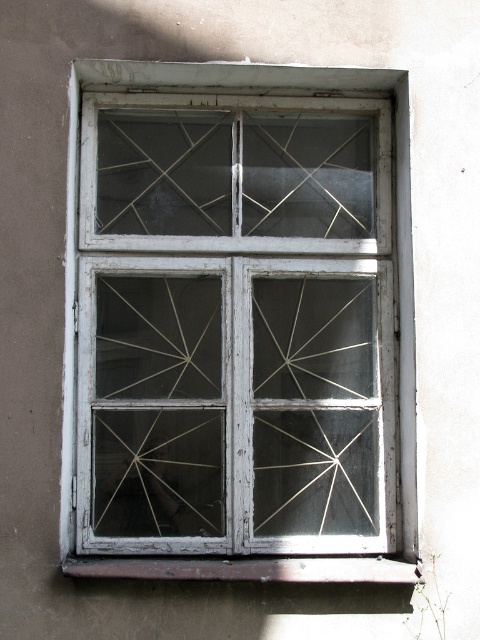
Question: Does white painted wood window frame at center have a lesser width compared to rusty metal window sill at lower center?

Choices:
 (A) no
 (B) yes

Answer: (B)

Question: Can you confirm if white painted wood window frame at center is positioned to the left of rusty metal window sill at lower center?

Choices:
 (A) yes
 (B) no

Answer: (A)

Question: Which point is farther to the camera?

Choices:
 (A) (300, 486)
 (B) (103, 573)

Answer: (A)

Question: In this image, where is white painted wood window frame at center located relative to rusty metal window sill at lower center?

Choices:
 (A) above
 (B) below

Answer: (A)

Question: Among these points, which one is nearest to the camera?

Choices:
 (A) (145, 561)
 (B) (106, 524)

Answer: (A)

Question: Among these objects, which one is farthest from the camera?

Choices:
 (A) rusty metal window sill at lower center
 (B) white painted wood window frame at center

Answer: (B)